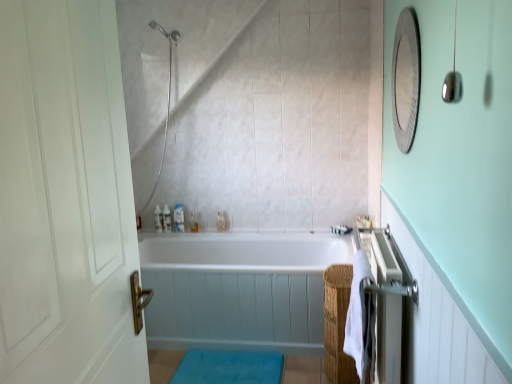
Where is `empty space that is ontop of blue plush bath mat at lower center`? The image size is (512, 384). empty space that is ontop of blue plush bath mat at lower center is located at coordinates (230, 357).